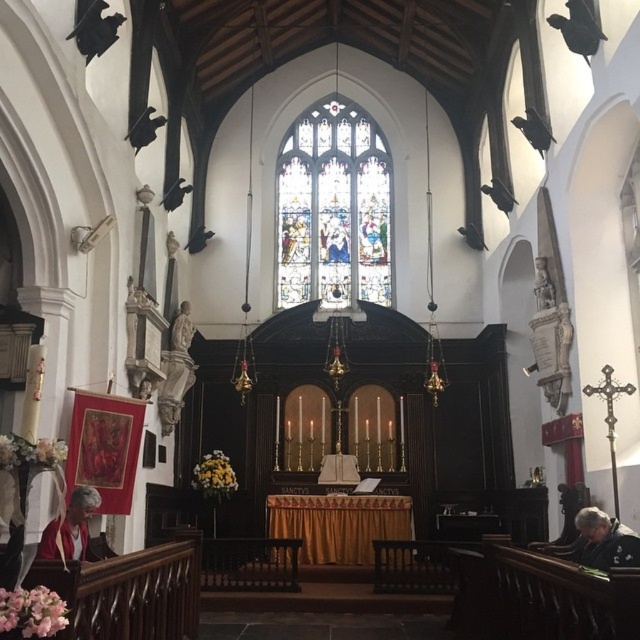
Is stained glass window at center below matte red robe at lower left?

No, stained glass window at center is not below matte red robe at lower left.

Which is more to the right, stained glass window at center or matte red robe at lower left?

Positioned to the right is stained glass window at center.

Describe the element at coordinates (333, 209) in the screenshot. The width and height of the screenshot is (640, 640). I see `stained glass window at center` at that location.

This screenshot has width=640, height=640. Find the location of `stained glass window at center`. stained glass window at center is located at coordinates (333, 209).

What do you see at coordinates (333, 209) in the screenshot? I see `stained glass window at center` at bounding box center [333, 209].

Is stained glass window at center thinner than gray fabric jacket at lower right?

No, stained glass window at center is not thinner than gray fabric jacket at lower right.

Find the location of `stained glass window at center`. stained glass window at center is located at coordinates (333, 209).

Between gray fabric jacket at lower right and matte red robe at lower left, which one has less height?

gray fabric jacket at lower right is shorter.

Can you confirm if gray fabric jacket at lower right is positioned above matte red robe at lower left?

No, gray fabric jacket at lower right is not above matte red robe at lower left.

Who is more forward, [625,534] or [77,504]?

Positioned in front is point [625,534].

Where is `gray fabric jacket at lower right`? The width and height of the screenshot is (640, 640). gray fabric jacket at lower right is located at coordinates (605, 540).